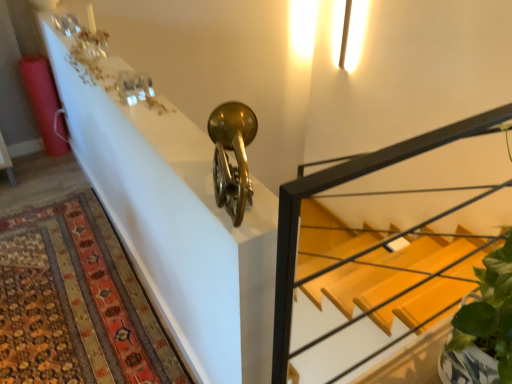
Identify the location of carpeted rug at lower left. Image resolution: width=512 pixels, height=384 pixels. (75, 302).

In order to face metallic gold trumpet at upper center, should I rotate leftwards or rightwards?

Turn left approximately 19.433 degrees to face it.

This screenshot has width=512, height=384. Describe the element at coordinates (339, 351) in the screenshot. I see `wooden stairs at center` at that location.

Locate an element on the screen. carpeted rug at lower left is located at coordinates (75, 302).

I want to click on table on the right of carpeted rug at lower left, so click(178, 225).

Would you consider metallic gold trumpet at upper center to be distant from carpeted rug at lower left?

Actually, metallic gold trumpet at upper center and carpeted rug at lower left are a little close together.

Would you say metallic gold trumpet at upper center is to the left or to the right of carpeted rug at lower left in the picture?

From the image, it's evident that metallic gold trumpet at upper center is to the right of carpeted rug at lower left.

Considering the relative sizes of metallic gold trumpet at upper center and carpeted rug at lower left in the image provided, is metallic gold trumpet at upper center bigger than carpeted rug at lower left?

Incorrect, metallic gold trumpet at upper center is not larger than carpeted rug at lower left.

Could you tell me if wooden stairs at center is turned towards metallic gold trumpet at upper center?

No.

From the image's perspective, is wooden stairs at center on metallic gold trumpet at upper center?

Incorrect, from the image's perspective, wooden stairs at center is lower than metallic gold trumpet at upper center.

Are wooden stairs at center and metallic gold trumpet at upper center located far from each other?

Yes.

Considering the sizes of objects wooden stairs at center and metallic gold trumpet at upper center in the image provided, who is wider, wooden stairs at center or metallic gold trumpet at upper center?

metallic gold trumpet at upper center.

Which object is positioned more to the left, wooden stairs at center or carpeted rug at lower left?

carpeted rug at lower left.

Which object is further away from the camera, wooden stairs at center or carpeted rug at lower left?

Positioned behind is carpeted rug at lower left.

Does carpeted rug at lower left have a smaller size compared to wooden stairs at center?

Indeed, carpeted rug at lower left has a smaller size compared to wooden stairs at center.

Is carpeted rug at lower left placed right next to wooden stairs at center?

No, carpeted rug at lower left is not with wooden stairs at center.

Who is taller, carpeted rug at lower left or wooden stairs at center?

With more height is wooden stairs at center.

Is point (120, 351) positioned after point (399, 276)?

That is False.

From a real-world perspective, between carpeted rug at lower left and metallic gold trumpet at upper center, who is vertically lower?

In real-world perspective, carpeted rug at lower left is lower.

Would you say carpeted rug at lower left contains metallic gold trumpet at upper center?

Definitely not — metallic gold trumpet at upper center is not inside carpeted rug at lower left.

Does carpeted rug at lower left appear on the right side of metallic gold trumpet at upper center?

Incorrect, carpeted rug at lower left is not on the right side of metallic gold trumpet at upper center.

From the image's perspective, is carpeted rug at lower left under metallic gold trumpet at upper center?

Indeed, from the image's perspective, carpeted rug at lower left is shown beneath metallic gold trumpet at upper center.

Choose the correct answer: Is metallic gold trumpet at upper center inside wooden stairs at center or outside it?

metallic gold trumpet at upper center cannot be found inside wooden stairs at center.

Are metallic gold trumpet at upper center and wooden stairs at center far apart?

Absolutely, metallic gold trumpet at upper center is distant from wooden stairs at center.

Between metallic gold trumpet at upper center and wooden stairs at center, which one has larger size?

With larger size is wooden stairs at center.

Can you tell me how much metallic gold trumpet at upper center and wooden stairs at center differ in facing direction?

The facing directions of metallic gold trumpet at upper center and wooden stairs at center are 90.4 degrees apart.

The image size is (512, 384). I want to click on mat below the metallic gold trumpet at upper center (from a real-world perspective), so click(75, 302).

Locate an element on the screen. table above the wooden stairs at center (from a real-world perspective) is located at coordinates (178, 225).

Looking at the image, which one is located closer to carpeted rug at lower left, wooden stairs at center or metallic gold trumpet at upper center?

metallic gold trumpet at upper center is closer to carpeted rug at lower left.

From the image, which object appears to be farther from wooden stairs at center, metallic gold trumpet at upper center or carpeted rug at lower left?

metallic gold trumpet at upper center is positioned further to the anchor wooden stairs at center.

Looking at this image, considering their positions, is wooden stairs at center positioned closer to metallic gold trumpet at upper center than carpeted rug at lower left?

carpeted rug at lower left.

Consider the image. Which object lies nearer to the anchor point carpeted rug at lower left, metallic gold trumpet at upper center or wooden stairs at center?

Among the two, metallic gold trumpet at upper center is located nearer to carpeted rug at lower left.

Looking at the image, which one is located closer to metallic gold trumpet at upper center, carpeted rug at lower left or wooden stairs at center?

Based on the image, carpeted rug at lower left appears to be nearer to metallic gold trumpet at upper center.

Considering their positions, is carpeted rug at lower left positioned further to wooden stairs at center than metallic gold trumpet at upper center?

Among the two, metallic gold trumpet at upper center is located further to wooden stairs at center.

The height and width of the screenshot is (384, 512). In order to click on table located between carpeted rug at lower left and wooden stairs at center in the left-right direction in this screenshot , I will do `click(178, 225)`.